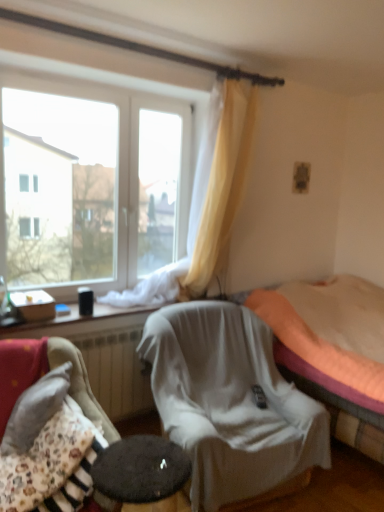
Locate an element on the screen. The height and width of the screenshot is (512, 384). white fabric chair at center, which appears as the first chair when viewed from the back is located at coordinates (229, 402).

Is black glossy coffee cup at lower left not close to transparent plastic container at lower left, placed as the 1th window when sorted from bottom to top?

No, black glossy coffee cup at lower left is not far away from transparent plastic container at lower left, placed as the 1th window when sorted from bottom to top.

From a real-world perspective, is black glossy coffee cup at lower left beneath transparent plastic container at lower left, placed as the 1th window when sorted from bottom to top?

No, from a real-world perspective, black glossy coffee cup at lower left is not beneath transparent plastic container at lower left, placed as the 1th window when sorted from bottom to top.

Can you confirm if black glossy coffee cup at lower left is shorter than transparent plastic container at lower left, arranged as the second window when viewed from the top?

Incorrect, the height of black glossy coffee cup at lower left does not fall short of that of transparent plastic container at lower left, arranged as the second window when viewed from the top.

From the image's perspective, would you say black glossy coffee cup at lower left is shown under transparent plastic container at lower left, placed as the 1th window when sorted from bottom to top?

No.

Considering the sizes of objects white fabric chair at center, which appears as the first chair when viewed from the back, and black plastic remote control at center in the image provided, who is smaller, white fabric chair at center, which appears as the first chair when viewed from the back, or black plastic remote control at center?

black plastic remote control at center.

Considering the sizes of objects white fabric chair at center, which appears as the first chair when viewed from the back, and black plastic remote control at center in the image provided, who is wider, white fabric chair at center, which appears as the first chair when viewed from the back, or black plastic remote control at center?

Wider between the two is white fabric chair at center, which appears as the first chair when viewed from the back.

Considering the sizes of objects white fabric chair at center, arranged as the 2th chair when viewed from the front, and black plastic remote control at center in the image provided, who is taller, white fabric chair at center, arranged as the 2th chair when viewed from the front, or black plastic remote control at center?

white fabric chair at center, arranged as the 2th chair when viewed from the front, is taller.

Do you think black glossy coffee cup at lower left is within floral fabric cushion at lower left, which ranks as the 2th chair in right-to-left order, or outside of it?

black glossy coffee cup at lower left lies outside floral fabric cushion at lower left, which ranks as the 2th chair in right-to-left order.

Is black glossy coffee cup at lower left oriented away from floral fabric cushion at lower left, which is the second chair in back-to-front order?

No, floral fabric cushion at lower left, which is the second chair in back-to-front order, is not at the back of black glossy coffee cup at lower left.

Between black glossy coffee cup at lower left and floral fabric cushion at lower left, placed as the first chair when sorted from front to back, which one has larger width?

floral fabric cushion at lower left, placed as the first chair when sorted from front to back, is wider.

Considering the relative positions of black glossy coffee cup at lower left and white fabric chair at center, arranged as the 2th chair when viewed from the front, in the image provided, is black glossy coffee cup at lower left to the left of white fabric chair at center, arranged as the 2th chair when viewed from the front, from the viewer's perspective?

Correct, you'll find black glossy coffee cup at lower left to the left of white fabric chair at center, arranged as the 2th chair when viewed from the front.

Are black glossy coffee cup at lower left and white fabric chair at center, arranged as the 2th chair when viewed from the front, far apart?

They are positioned close to each other.

Can we say black glossy coffee cup at lower left lies outside white fabric chair at center, arranged as the 2th chair when viewed from the front?

Yes.

Is black glossy coffee cup at lower left thinner than white fabric chair at center, the second chair positioned from the left?

Indeed, black glossy coffee cup at lower left has a lesser width compared to white fabric chair at center, the second chair positioned from the left.

Is orange fabric bed at center touching white fabric chair at center, which appears as the first chair when viewed from the back?

They are not placed beside each other.

Considering the relative sizes of orange fabric bed at center and white fabric chair at center, which appears as the first chair when viewed from the back, in the image provided, is orange fabric bed at center taller than white fabric chair at center, which appears as the first chair when viewed from the back,?

Yes, orange fabric bed at center is taller than white fabric chair at center, which appears as the first chair when viewed from the back.

From a real-world perspective, which object rests below the other?

In real-world perspective, white fabric chair at center, the second chair positioned from the left, is lower.

Does point (302, 352) appear closer or farther from the camera than point (200, 369)?

Clearly, point (302, 352) is more distant from the camera than point (200, 369).

From a real-world perspective, which is physically below, white fabric chair at center, the second chair positioned from the left, or orange fabric bed at center?

In real-world perspective, white fabric chair at center, the second chair positioned from the left, is lower.

Could you tell me if white fabric chair at center, the second chair positioned from the left, is turned towards orange fabric bed at center?

No, white fabric chair at center, the second chair positioned from the left, is not turned towards orange fabric bed at center.

From the image's perspective, would you say white fabric chair at center, arranged as the first chair when viewed from the right, is positioned over orange fabric bed at center?

No, from the image's perspective, white fabric chair at center, arranged as the first chair when viewed from the right, is not over orange fabric bed at center.

How much distance is there between white fabric chair at center, which appears as the first chair when viewed from the back, and floral fabric cushion at lower left, placed as the first chair when sorted from front to back?

A distance of 28.53 inches exists between white fabric chair at center, which appears as the first chair when viewed from the back, and floral fabric cushion at lower left, placed as the first chair when sorted from front to back.

In the image, there is a floral fabric cushion at lower left, which ranks as the 2th chair in right-to-left order. Where is `chair below it (from the image's perspective)`? chair below it (from the image's perspective) is located at coordinates (229, 402).

Is point (220, 459) positioned behind point (68, 358)?

No, (220, 459) is in front of (68, 358).

In the image, is white fabric chair at center, arranged as the 2th chair when viewed from the front, positioned in front of or behind floral fabric cushion at lower left, which is the second chair in back-to-front order?

Visually, white fabric chair at center, arranged as the 2th chair when viewed from the front, is located behind floral fabric cushion at lower left, which is the second chair in back-to-front order.

Image resolution: width=384 pixels, height=512 pixels. What are the coordinates of `coffee cup above the transparent plastic container at lower left, arranged as the second window when viewed from the top (from the image's perspective)` in the screenshot? It's located at (85, 300).

Identify the location of remote control below the white fabric chair at center, arranged as the 2th chair when viewed from the front (from a real-world perspective). (259, 396).

Estimate the real-world distances between objects in this image. Which object is closer to black plastic remote control at center, transparent glass window at upper left, the 2th window ordered from the bottom, or white fabric chair at center, which appears as the first chair when viewed from the back?

white fabric chair at center, which appears as the first chair when viewed from the back.

Looking at the image, which one is located further to white fabric chair at center, arranged as the first chair when viewed from the right, black glossy coffee cup at lower left or transparent plastic container at lower left, arranged as the second window when viewed from the top?

black glossy coffee cup at lower left.

Considering their positions, is floral fabric cushion at lower left, which is the second chair in back-to-front order, positioned further to orange fabric bed at center than transparent glass window at upper left, the 2th window ordered from the bottom?

floral fabric cushion at lower left, which is the second chair in back-to-front order, is further to orange fabric bed at center.

Considering their positions, is black glossy coffee cup at lower left positioned further to transparent plastic container at lower left, arranged as the second window when viewed from the top, than orange fabric bed at center?

The object further to transparent plastic container at lower left, arranged as the second window when viewed from the top, is orange fabric bed at center.

When comparing their distances from black plastic remote control at center, does orange fabric bed at center or floral fabric cushion at lower left, which is the second chair in back-to-front order, seem closer?

orange fabric bed at center lies closer to black plastic remote control at center than the other object.

When comparing their distances from black glossy coffee cup at lower left, does white fabric chair at center, arranged as the 2th chair when viewed from the front, or orange fabric bed at center seem closer?

white fabric chair at center, arranged as the 2th chair when viewed from the front, is closer to black glossy coffee cup at lower left.

From the image, which object appears to be farther from white fabric chair at center, which appears as the first chair when viewed from the back, transparent glass window at upper left, arranged as the first window when viewed from the top, or floral fabric cushion at lower left, which ranks as the 2th chair in right-to-left order?

Among the two, transparent glass window at upper left, arranged as the first window when viewed from the top, is located further to white fabric chair at center, which appears as the first chair when viewed from the back.

Which object lies nearer to the anchor point black glossy coffee cup at lower left, transparent glass window at upper left, arranged as the first window when viewed from the top, or white fabric chair at center, the second chair positioned from the left?

Among the two, transparent glass window at upper left, arranged as the first window when viewed from the top, is located nearer to black glossy coffee cup at lower left.

Image resolution: width=384 pixels, height=512 pixels. I want to click on coffee cup that lies between transparent glass window at upper left, arranged as the first window when viewed from the top, and black plastic remote control at center from top to bottom, so click(85, 300).

In order to click on window between floral fabric cushion at lower left, which is the second chair in back-to-front order, and transparent glass window at upper left, arranged as the first window when viewed from the top, in the front-back direction in this screenshot , I will do `click(81, 322)`.

I want to click on window between transparent glass window at upper left, arranged as the first window when viewed from the top, and black plastic remote control at center from top to bottom, so click(81, 322).

Find the location of a particular element. chair between floral fabric cushion at lower left, placed as the first chair when sorted from front to back, and black plastic remote control at center from front to back is located at coordinates (229, 402).